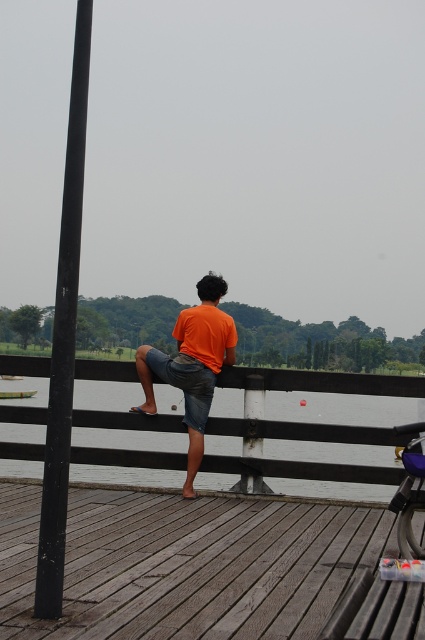
Question: Can you confirm if wooden at center is wider than orange cotton shirt at center?

Choices:
 (A) yes
 (B) no

Answer: (A)

Question: Which object appears closest to the camera in this image?

Choices:
 (A) wooden dock at center
 (B) wooden at center
 (C) orange cotton shirt at center

Answer: (A)

Question: Is wooden at center thinner than orange cotton shirt at center?

Choices:
 (A) yes
 (B) no

Answer: (B)

Question: Where is wooden dock at center located in relation to black matte pole at left in the image?

Choices:
 (A) right
 (B) left

Answer: (A)

Question: Which object is the closest to the wooden dock at center?

Choices:
 (A) black matte pole at left
 (B) wooden at center

Answer: (B)

Question: Which object appears farthest from the camera in this image?

Choices:
 (A) orange cotton shirt at center
 (B) wooden dock at center

Answer: (A)